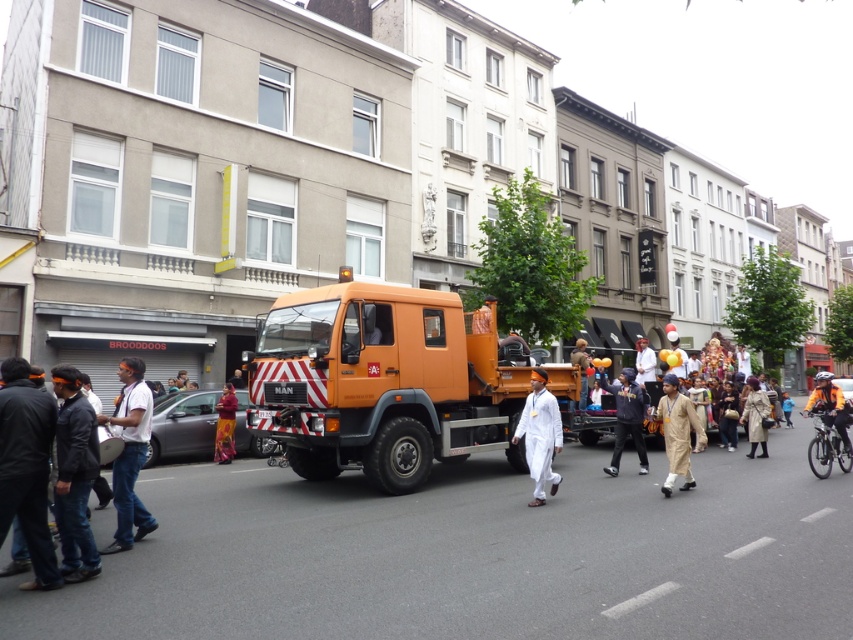
You are standing at the point with coordinates point (424, 467) and want to walk to the point with coordinates point (819, 396). Which direction should you move to get closer to your destination?

To move closer to point (819, 396) from point (424, 467), you should move in the direction towards the upper right since point (424, 467) is in front of point (819, 396).

You are standing at the back of the large orange utility truck with a red and white striped front bumper. You want to take a photo of the white cotton outfit at center. Is the camera on your person close enough to do so without moving from your current position?

The white cotton outfit at center and camera are 8.61 meters apart. Since the camera is on your person, the distance between you and the white cotton outfit at center is 8.61 meters, which is within a typical camera range. Therefore, you can take the photo without moving.